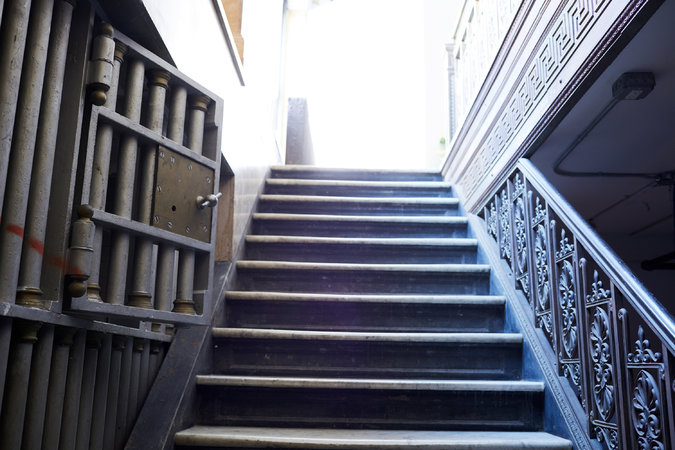
Where is `shelf (platform) area of steps`? shelf (platform) area of steps is located at coordinates (313, 169), (310, 181), (310, 197), (308, 215), (306, 239), (302, 262), (300, 294), (298, 331), (292, 379), (290, 439).